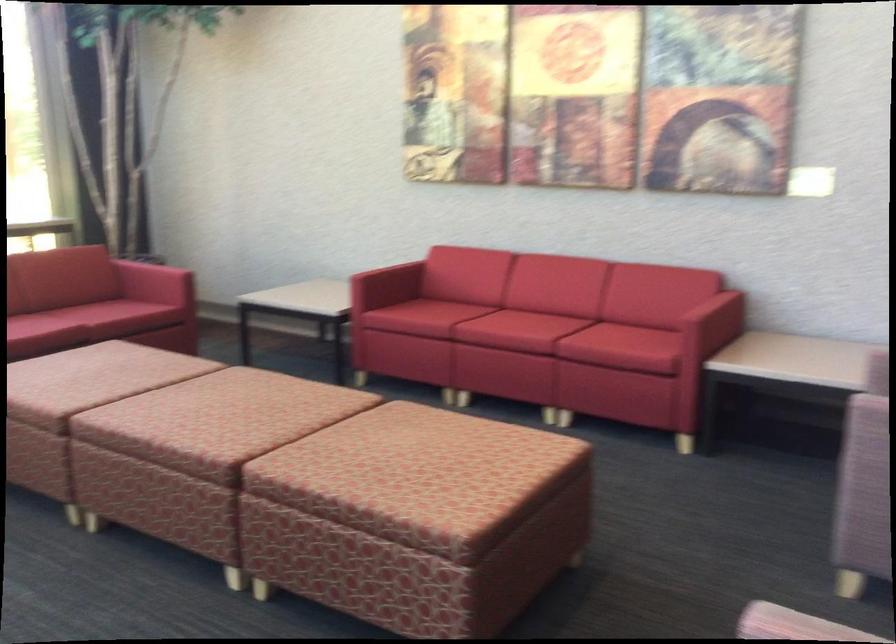
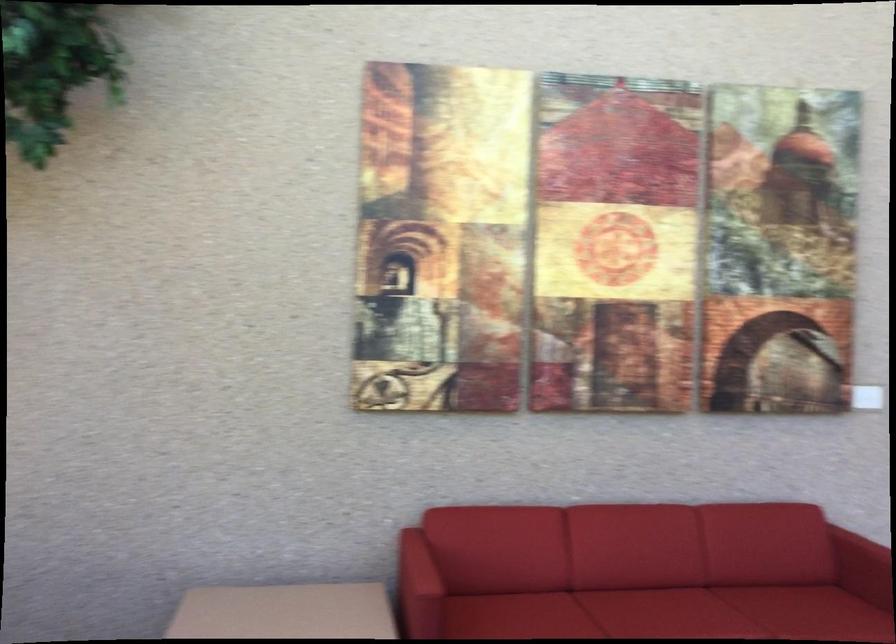
Find the pixel in the second image that matches point (700, 306) in the first image.

(864, 558)